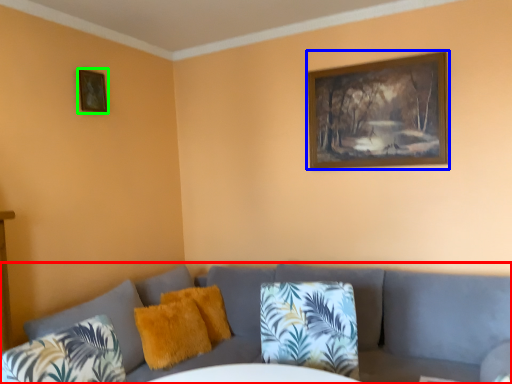
Question: Which is nearer to the studio couch (highlighted by a red box)? picture frame (highlighted by a blue box) or picture frame (highlighted by a green box).

Choices:
 (A) picture frame
 (B) picture frame

Answer: (A)